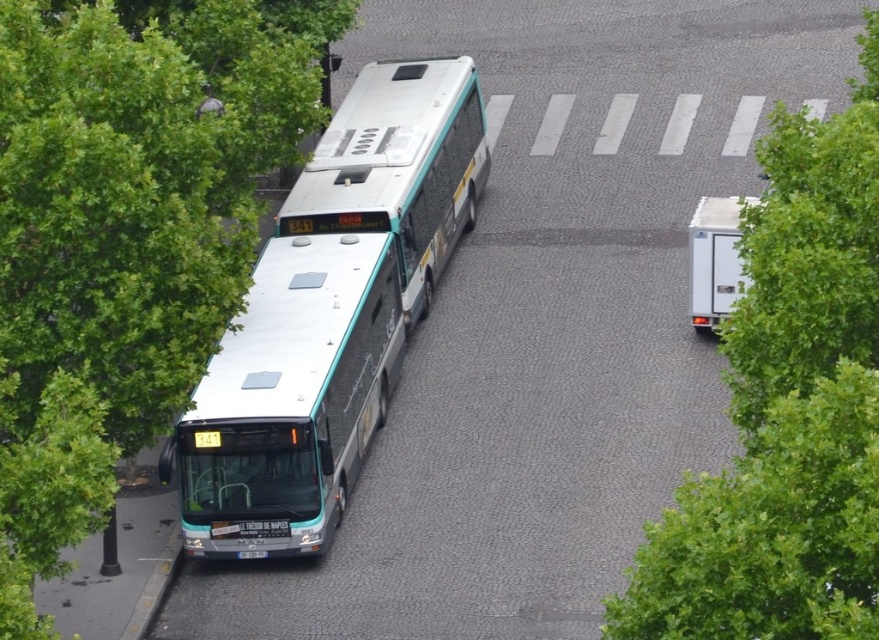
Question: Estimate the real-world distances between objects in this image. Which object is closer to the green leafy tree at center right?

Choices:
 (A) white plastic box at right
 (B) green leafy tree at left

Answer: (B)

Question: Among these points, which one is nearest to the camera?

Choices:
 (A) (351, 444)
 (B) (735, 412)
 (C) (213, 288)

Answer: (B)

Question: Which point is farther to the camera?

Choices:
 (A) [x=698, y=305]
 (B) [x=55, y=260]
 (C) [x=858, y=248]

Answer: (A)

Question: In this image, where is green leafy tree at center right located relative to white plastic box at right?

Choices:
 (A) above
 (B) below

Answer: (A)

Question: Does white metallic bus at center appear on the right side of white plastic box at right?

Choices:
 (A) yes
 (B) no

Answer: (B)

Question: Does green leafy tree at left appear on the left side of white metallic bus at center?

Choices:
 (A) no
 (B) yes

Answer: (B)